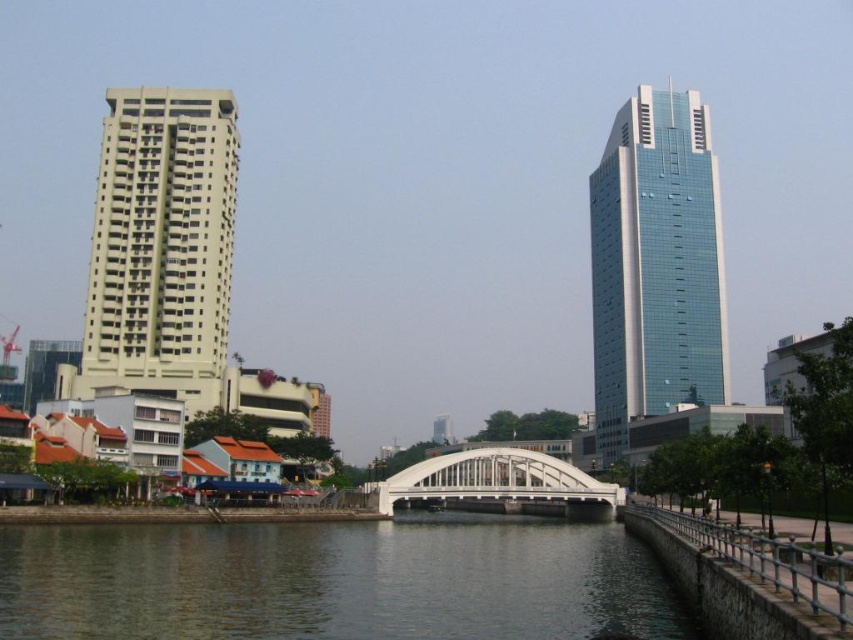
Does blue glass skyscraper at right have a lesser height compared to white metallic bridge at center?

No.

Measure the distance between blue glass skyscraper at right and white metallic bridge at center.

blue glass skyscraper at right and white metallic bridge at center are 159.77 feet apart from each other.

Describe the element at coordinates (654, 266) in the screenshot. The image size is (853, 640). I see `blue glass skyscraper at right` at that location.

I want to click on blue glass skyscraper at right, so click(x=654, y=266).

Which is below, clear water at center or blue glass skyscraper at right?

clear water at center

From the picture: Can you confirm if clear water at center is positioned above blue glass skyscraper at right?

No, clear water at center is not above blue glass skyscraper at right.

You are a GUI agent. You are given a task and a screenshot of the screen. Output one action in this format:
    pyautogui.click(x=<x>, y=<y>)
    Task: Click on the clear water at center
    
    Given the screenshot: What is the action you would take?
    pyautogui.click(x=334, y=580)

Where is `clear water at center`? clear water at center is located at coordinates (334, 580).

Is beige concrete building at left bigger than white metallic bridge at center?

No.

Does beige concrete building at left have a greater height compared to white metallic bridge at center?

Yes, beige concrete building at left is taller than white metallic bridge at center.

The image size is (853, 640). Describe the element at coordinates (161, 244) in the screenshot. I see `beige concrete building at left` at that location.

Where is `beige concrete building at left`? beige concrete building at left is located at coordinates (161, 244).